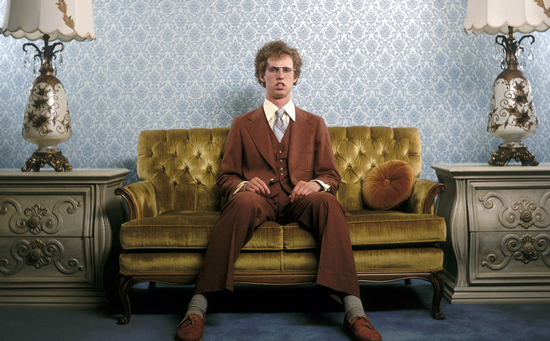
What are the coordinates of `lamp shade` in the screenshot? It's located at coord(36,20), coord(499,4).